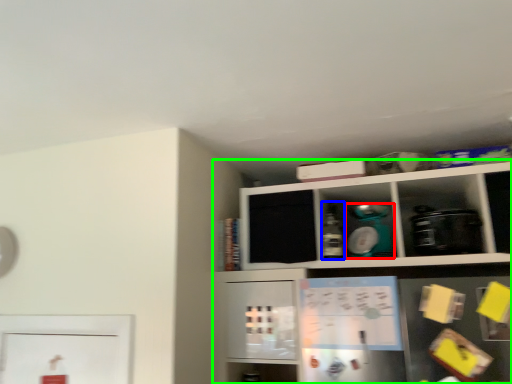
Question: Which is nearer to the appliance (highlighted by a red box)? bottle (highlighted by a blue box) or shelf (highlighted by a green box).

Choices:
 (A) bottle
 (B) shelf

Answer: (A)